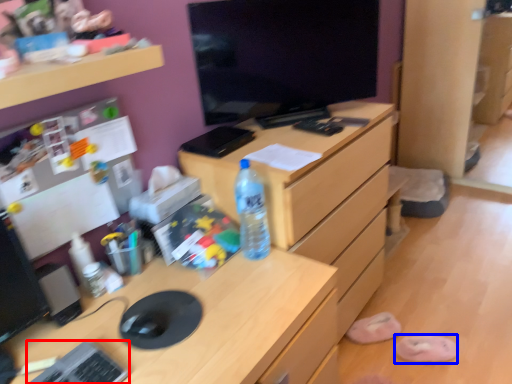
Question: Among these objects, which one is farthest to the camera, keyboard (highlighted by a red box) or slipper (highlighted by a blue box)?

Choices:
 (A) keyboard
 (B) slipper

Answer: (B)